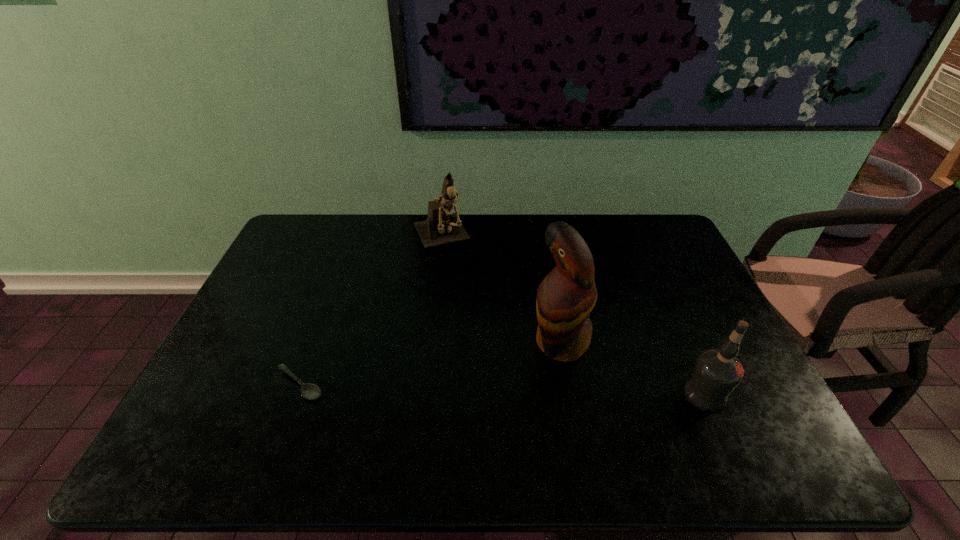
You are a GUI agent. You are given a task and a screenshot of the screen. Output one action in this format:
    pyautogui.click(x=<x>, y=<y>)
    Task: Click on the free location that satisfies the following two spatial constraints: 1. on the front side of the soupspoon; 2. on the front label of the rightmost object
    This screenshot has width=960, height=540.
    Given the screenshot: What is the action you would take?
    pyautogui.click(x=297, y=394)

Where is `free spot that satisfies the following two spatial constraints: 1. on the front side of the second tallest object; 2. on the front label of the rightmost object`? The width and height of the screenshot is (960, 540). free spot that satisfies the following two spatial constraints: 1. on the front side of the second tallest object; 2. on the front label of the rightmost object is located at coordinates (423, 394).

Locate an element on the screen. This screenshot has width=960, height=540. vacant position in the image that satisfies the following two spatial constraints: 1. on the front side of the rightmost object; 2. on the front label of the leftmost object is located at coordinates (297, 394).

You are a GUI agent. You are given a task and a screenshot of the screen. Output one action in this format:
    pyautogui.click(x=<x>, y=<y>)
    Task: Click on the free space that satisfies the following two spatial constraints: 1. on the front side of the vodka; 2. on the front label of the second tallest object
    The image size is (960, 540).
    Given the screenshot: What is the action you would take?
    pyautogui.click(x=423, y=394)